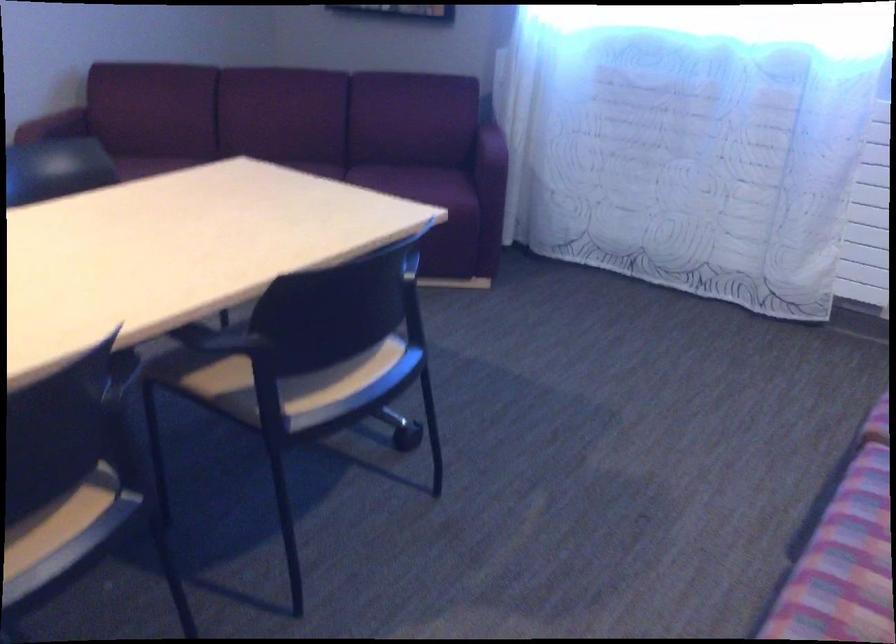
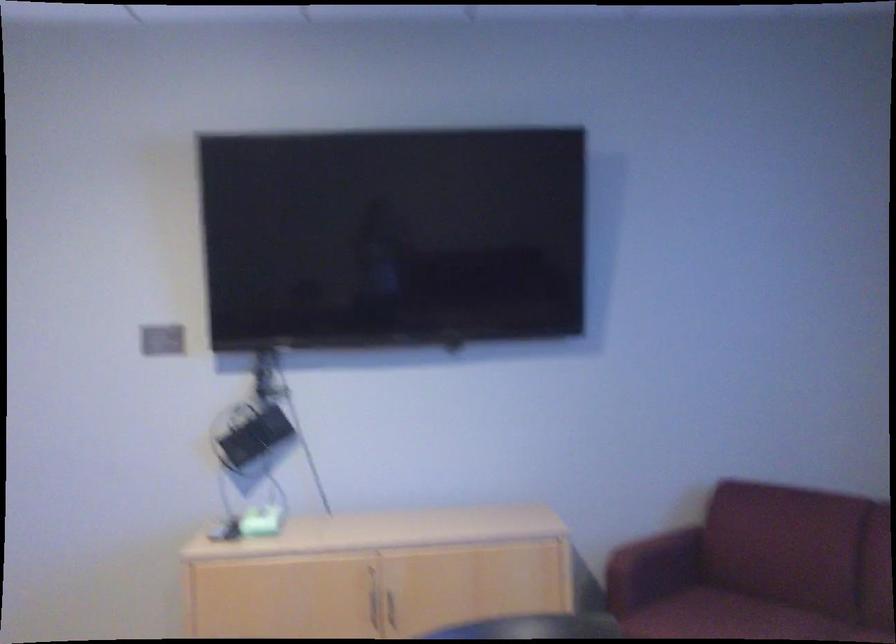
Question: The camera is either moving clockwise (left) or counter-clockwise (right) around the object. The first image is from the beginning of the video and the second image is from the end. Is the camera moving left or right when shooting the video?

Choices:
 (A) Left
 (B) Right

Answer: (B)